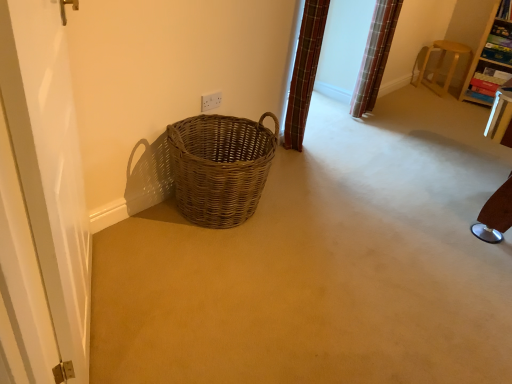
Identify the location of vacant area that lies between white glossy screen door at left and woven brown basket at center. The height and width of the screenshot is (384, 512). (163, 272).